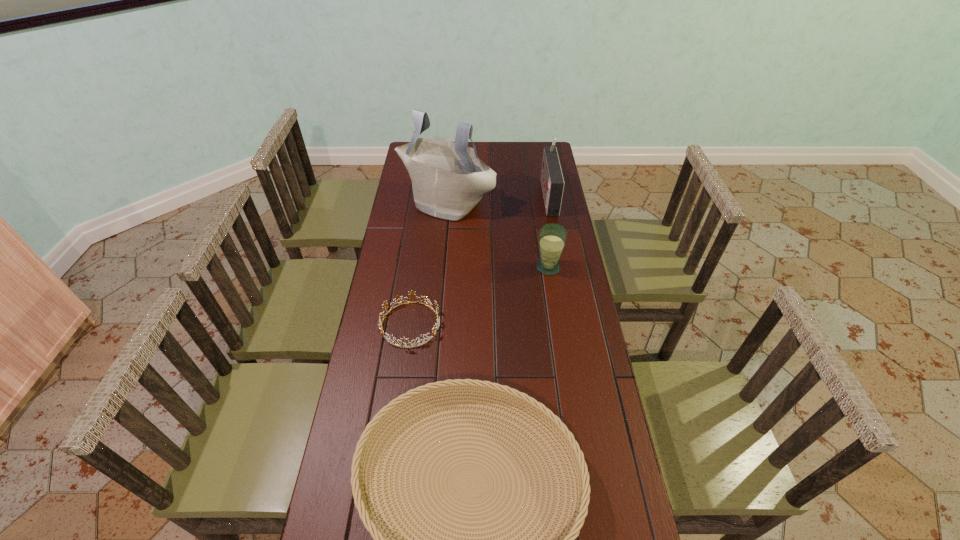
This screenshot has width=960, height=540. Identify the location of shopping bag. point(448,179).

What are the coordinates of `the second tallest object` in the screenshot? It's located at (552, 181).

I want to click on glass, so click(552, 238).

The image size is (960, 540). What are the coordinates of `the third nearest object` in the screenshot? It's located at (552, 238).

The height and width of the screenshot is (540, 960). What are the coordinates of `the fourth farthest object` in the screenshot? It's located at (412, 293).

Where is `tiara`? The image size is (960, 540). tiara is located at coordinates (412, 293).

This screenshot has height=540, width=960. What are the coordinates of `free space located on the right of the shopping bag` in the screenshot? It's located at (551, 201).

Image resolution: width=960 pixels, height=540 pixels. I want to click on vacant area situated 0.230m on the front panel of the radio receiver, so click(x=490, y=195).

Find the location of a particular element. This screenshot has height=540, width=960. vacant area located 0.220m on the front panel of the radio receiver is located at coordinates (492, 195).

You are a GUI agent. You are given a task and a screenshot of the screen. Output one action in this format:
    pyautogui.click(x=<x>, y=<y>)
    Task: Click on the vacant space located 0.360m on the front panel of the radio receiver
    This screenshot has height=540, width=960.
    Given the screenshot: What is the action you would take?
    pyautogui.click(x=461, y=195)